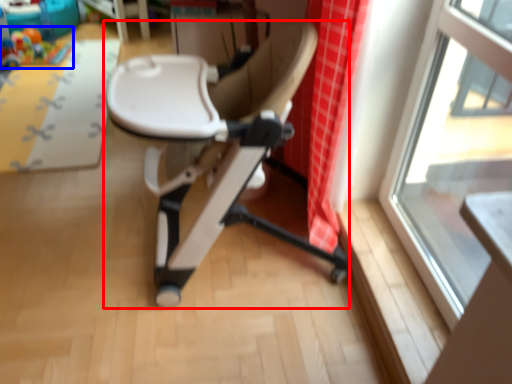
Question: Which of the following is the farthest to the observer, chair (highlighted by a red box) or toy (highlighted by a blue box)?

Choices:
 (A) chair
 (B) toy

Answer: (B)